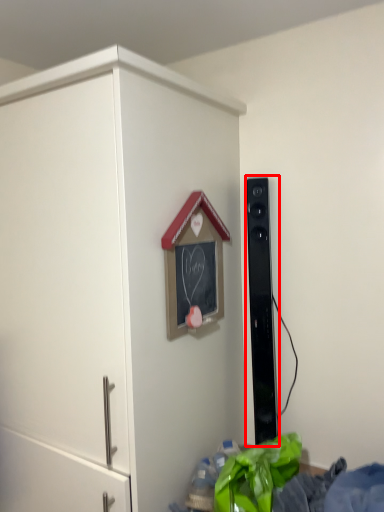
Question: Where is speaker (annotated by the red box) located in relation to cupboard in the image?

Choices:
 (A) left
 (B) right

Answer: (B)